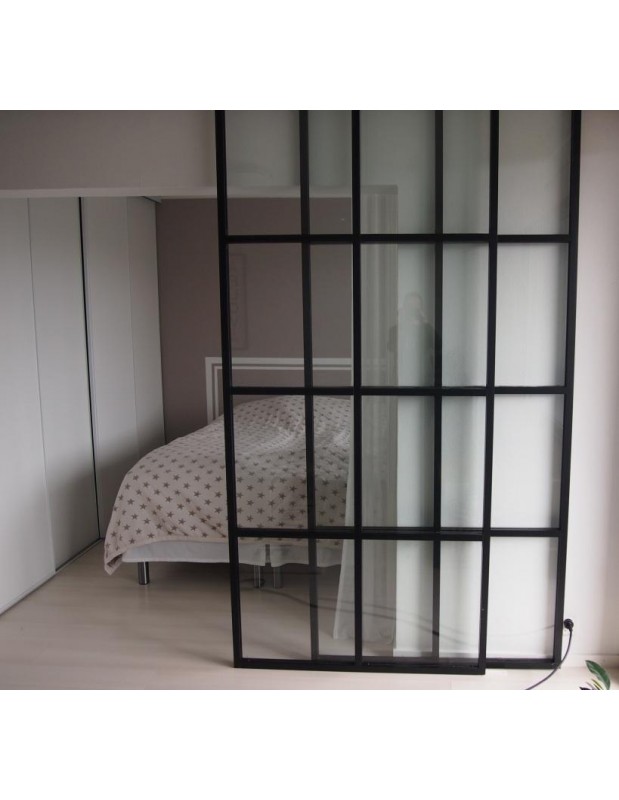
You are a GUI agent. You are given a task and a screenshot of the screen. Output one action in this format:
    pyautogui.click(x=<x>, y=<y>)
    Task: Click on the bed leg
    The width and height of the screenshot is (619, 800).
    Given the screenshot: What is the action you would take?
    pyautogui.click(x=145, y=577), pyautogui.click(x=254, y=578), pyautogui.click(x=277, y=582)